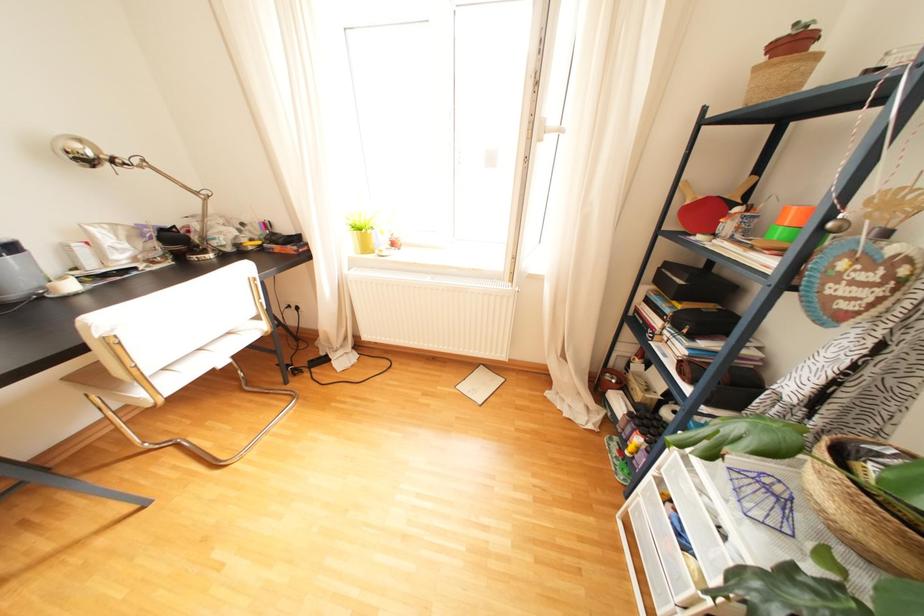
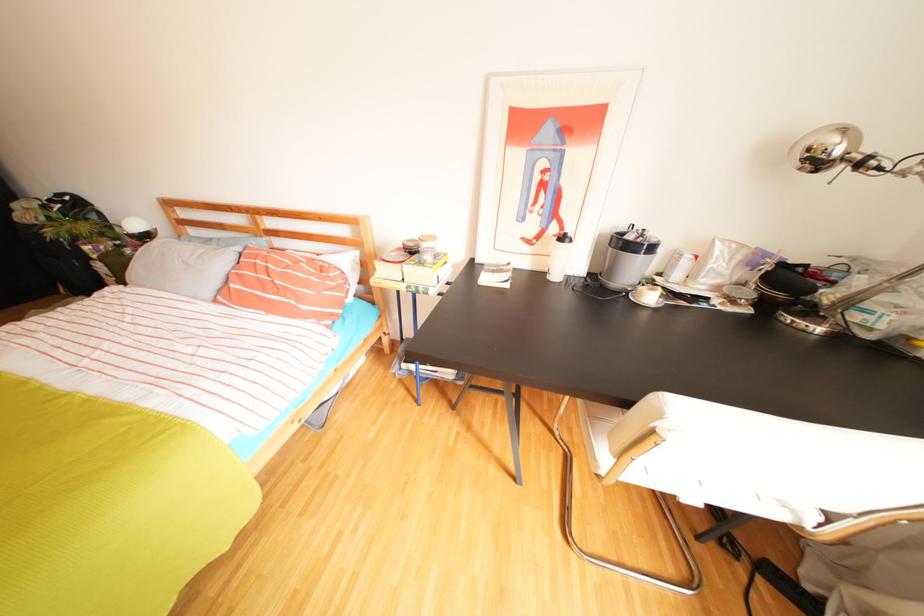
First-person continuous shooting, in which direction is the camera rotating?

The camera's rotation is toward left-down.